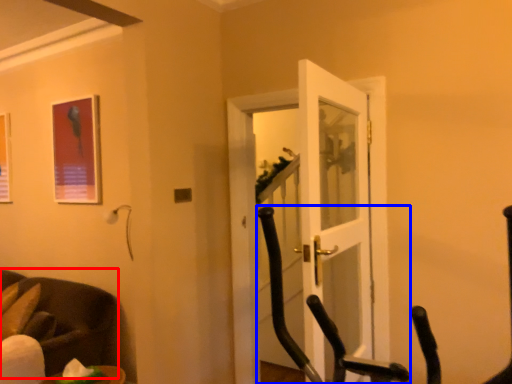
Question: Among these objects, which one is farthest to the camera, chair (highlighted by a red box) or rocking chair (highlighted by a blue box)?

Choices:
 (A) chair
 (B) rocking chair

Answer: (A)